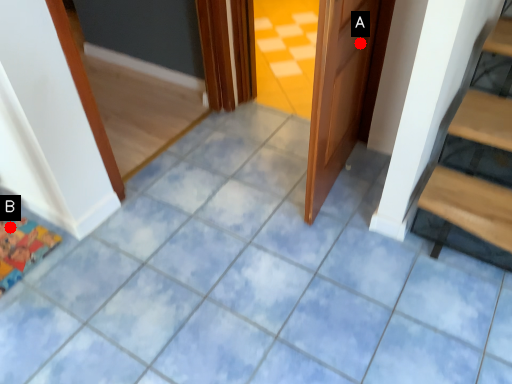
Question: Two points are circled on the image, labeled by A and B beside each circle. Which point is closer to the camera?

Choices:
 (A) A is closer
 (B) B is closer

Answer: (A)